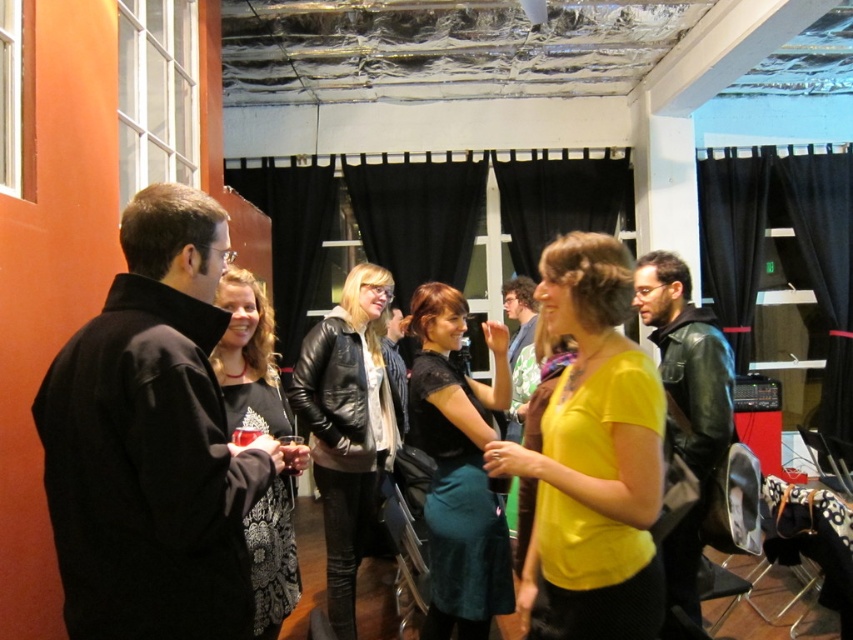
Does yellow matte shirt at center appear under black velvet dress at center?

No.

Does point (506, 444) lie in front of point (430, 579)?

Yes, point (506, 444) is in front of point (430, 579).

Is point (578, 481) positioned before point (447, 349)?

Yes, point (578, 481) is in front of point (447, 349).

Find the location of `yellow matte shirt at center`. yellow matte shirt at center is located at coordinates (592, 458).

Between black velvet dress at center and leather jacket at center, which one has more height?

leather jacket at center

This screenshot has height=640, width=853. Find the location of `black velvet dress at center`. black velvet dress at center is located at coordinates (457, 467).

Is yellow matte shirt at center above black lace dress at center?

Actually, yellow matte shirt at center is below black lace dress at center.

Does yellow matte shirt at center appear under black lace dress at center?

Yes.

Locate an element on the screen. This screenshot has height=640, width=853. yellow matte shirt at center is located at coordinates (592, 458).